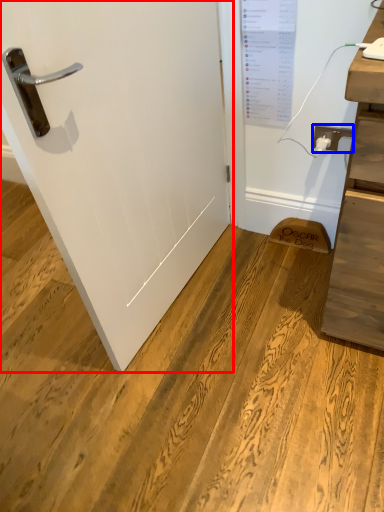
Question: Which object appears farthest to the camera in this image, door (highlighted by a red box) or electric outlet (highlighted by a blue box)?

Choices:
 (A) door
 (B) electric outlet

Answer: (B)